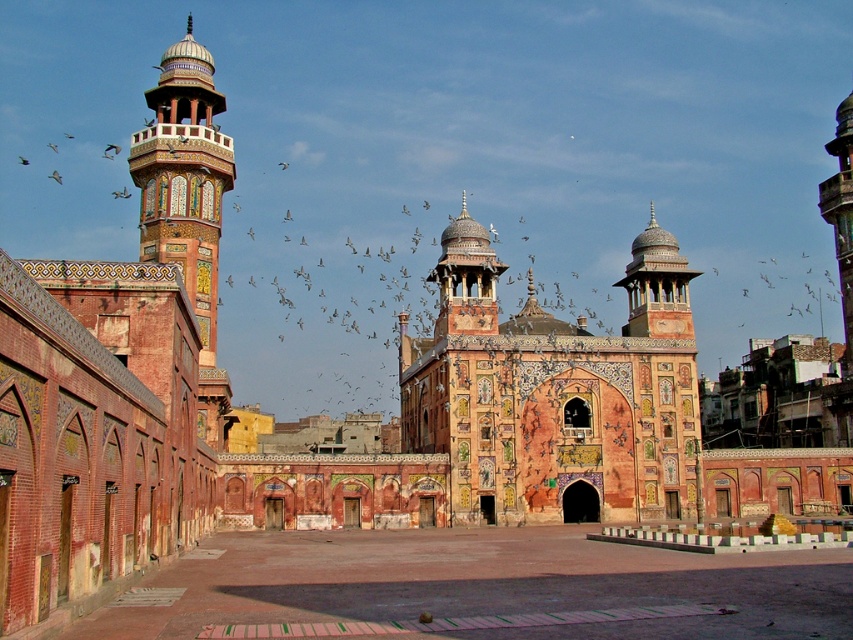
Question: Is terracotta mosaic palace at center above decorative mosaic minaret at left?

Choices:
 (A) yes
 (B) no

Answer: (B)

Question: Can you confirm if terracotta mosaic palace at center is thinner than decorative mosaic minaret at left?

Choices:
 (A) yes
 (B) no

Answer: (B)

Question: Is terracotta mosaic palace at center smaller than decorative mosaic minaret at left?

Choices:
 (A) yes
 (B) no

Answer: (A)

Question: Which of the following is the closest to the observer?

Choices:
 (A) (207, 157)
 (B) (679, 300)

Answer: (A)

Question: Which point is closer to the camera?

Choices:
 (A) terracotta mosaic palace at center
 (B) decorative mosaic minaret at left

Answer: (B)

Question: Which of the following is the farthest from the observer?

Choices:
 (A) (141, 136)
 (B) (613, 346)

Answer: (B)